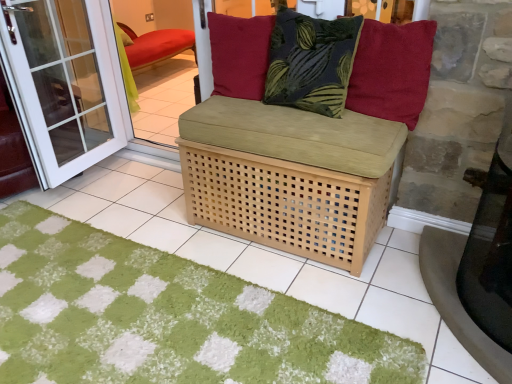
Question: Can you confirm if dark green textured pillow at center, arranged as the second pillow when viewed from the right, is positioned to the left of green shaggy doormat at center?

Choices:
 (A) yes
 (B) no

Answer: (B)

Question: From a real-world perspective, is dark green textured pillow at center, placed as the second pillow when sorted from left to right, physically above green shaggy doormat at center?

Choices:
 (A) no
 (B) yes

Answer: (B)

Question: Is dark green textured pillow at center, arranged as the second pillow when viewed from the right, next to green shaggy doormat at center and touching it?

Choices:
 (A) yes
 (B) no

Answer: (B)

Question: Are dark green textured pillow at center, placed as the second pillow when sorted from left to right, and green shaggy doormat at center located far from each other?

Choices:
 (A) yes
 (B) no

Answer: (A)

Question: Considering the relative sizes of dark green textured pillow at center, placed as the second pillow when sorted from left to right, and green shaggy doormat at center in the image provided, is dark green textured pillow at center, placed as the second pillow when sorted from left to right, taller than green shaggy doormat at center?

Choices:
 (A) no
 (B) yes

Answer: (B)

Question: Considering the positions of natural wood basket at center and red velvet cushion at upper center, the third pillow viewed from the right, in the image, is natural wood basket at center taller or shorter than red velvet cushion at upper center, the third pillow viewed from the right,?

Choices:
 (A) tall
 (B) short

Answer: (A)

Question: Is natural wood basket at center in front of or behind red velvet cushion at upper center, which is the first pillow from left to right, in the image?

Choices:
 (A) front
 (B) behind

Answer: (A)

Question: Considering the positions of natural wood basket at center and red velvet cushion at upper center, the third pillow viewed from the right, in the image, is natural wood basket at center bigger or smaller than red velvet cushion at upper center, the third pillow viewed from the right,?

Choices:
 (A) small
 (B) big

Answer: (B)

Question: Would you say natural wood basket at center is to the left or to the right of red velvet cushion at upper center, the third pillow viewed from the right, in the picture?

Choices:
 (A) left
 (B) right

Answer: (B)

Question: Based on their sizes in the image, would you say green shaggy doormat at center is bigger or smaller than red velvet cushion at upper center, the third pillow viewed from the right?

Choices:
 (A) small
 (B) big

Answer: (B)

Question: Visually, is green shaggy doormat at center positioned to the left or to the right of red velvet cushion at upper center, which is the first pillow from left to right?

Choices:
 (A) left
 (B) right

Answer: (A)

Question: Looking at their shapes, would you say green shaggy doormat at center is wider or thinner than red velvet cushion at upper center, the third pillow viewed from the right?

Choices:
 (A) thin
 (B) wide

Answer: (B)

Question: Is green shaggy doormat at center in front of or behind red velvet cushion at upper center, the third pillow viewed from the right, in the image?

Choices:
 (A) behind
 (B) front

Answer: (B)

Question: Would you say green shaggy doormat at center is to the left or to the right of natural wood basket at center in the picture?

Choices:
 (A) right
 (B) left

Answer: (B)

Question: In terms of height, does green shaggy doormat at center look taller or shorter compared to natural wood basket at center?

Choices:
 (A) tall
 (B) short

Answer: (B)